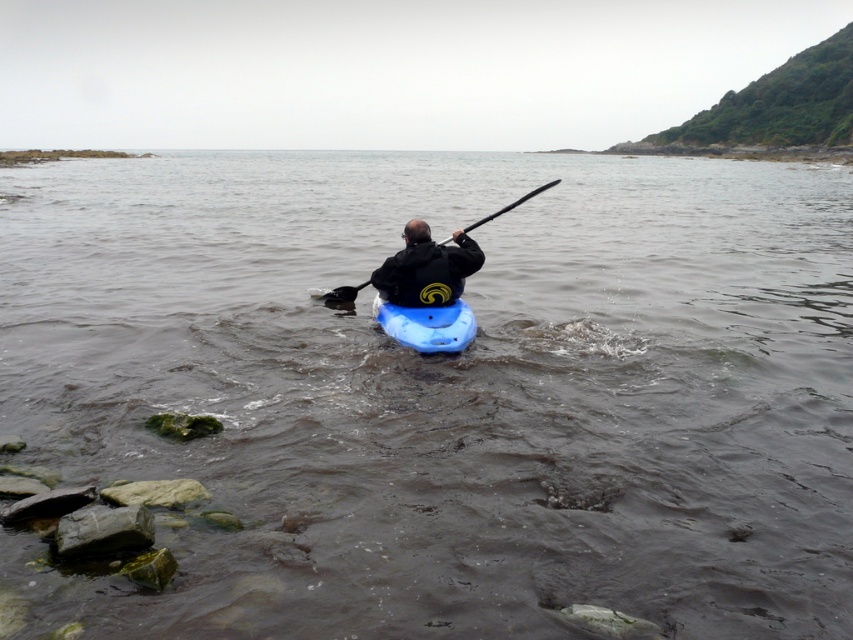
You are a kayaker who just finished a trip and need to secure your gear. You have a storage rack that can hold items up to 6 feet apart. Can you safely place both the black matte jacket at center and the black plastic paddle at center on the rack without them overlapping?

The distance between the black matte jacket at center and the black plastic paddle at center is 6.37 feet. Since the rack can only accommodate items up to 6 feet apart, placing them on the rack would cause overlap as the required spacing exceeds the rack capacity.

You are observing a kayaker from a nearby boat. You notice the black matte jacket at center and the blue matte kayak at center. Which object appears taller from your vantage point?

The black matte jacket at center appears taller than the blue matte kayak at center because it has a greater height compared to it.

From the picture: You are standing on the shore of the lake and see the black matte jacket at center on the kayak. If you want to throw a lifebuoy to the person wearing the jacket, and your throwing range is 7 meters, will you be able to reach them?

The distance between the black matte jacket at center and the camera is 7.49 meters, which exceeds your throwing range of 7 meters. Therefore, you won t be able to reach them with the lifebuoy.